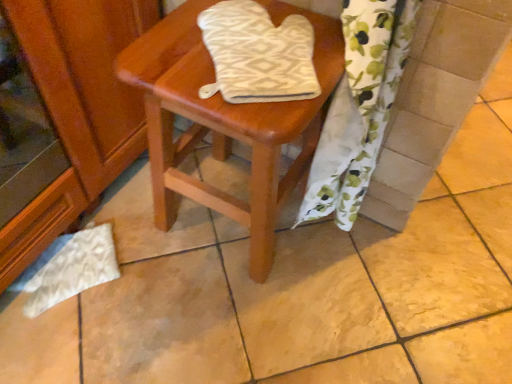
Measure the distance between point [346,131] and camera.

Point [346,131] and camera are 28.70 inches apart from each other.

The width and height of the screenshot is (512, 384). What do you see at coordinates (359, 108) in the screenshot? I see `white floral fabric at lower right` at bounding box center [359, 108].

In order to face white textured oven mitt at center, should I rotate leftwards or rightwards?

To align with it, rotate right about 2.340°.

Locate an element on the screen. This screenshot has height=384, width=512. white floral fabric at lower right is located at coordinates (359, 108).

Relative to white textured oven mitt at center, is wooden stool at center in front or behind?

Visually, wooden stool at center is located in front of white textured oven mitt at center.

Can you confirm if wooden stool at center is positioned to the right of white textured oven mitt at center?

No, wooden stool at center is not to the right of white textured oven mitt at center.

From the image's perspective, is wooden stool at center under white textured oven mitt at center?

Correct, wooden stool at center appears lower than white textured oven mitt at center in the image.

Is wooden stool at center with white textured oven mitt at center?

wooden stool at center and white textured oven mitt at center are not in contact.

Is wooden stool at center aimed at white floral fabric at lower right?

No.

Locate an element on the screen. The height and width of the screenshot is (384, 512). curtain above the wooden stool at center (from a real-world perspective) is located at coordinates (359, 108).

Consider the image. Is wooden stool at center closer to the viewer compared to white floral fabric at lower right?

That is False.

Considering their positions, is white textured oven mitt at center located in front of or behind white floral fabric at lower right?

Clearly, white textured oven mitt at center is behind white floral fabric at lower right.

Considering the points (267, 97) and (342, 103), which point is behind, point (267, 97) or point (342, 103)?

The point (342, 103) is more distant.

How far apart are white textured oven mitt at center and white floral fabric at lower right?

The distance of white textured oven mitt at center from white floral fabric at lower right is 17.68 centimeters.

Is white textured oven mitt at center looking in the opposite direction of white floral fabric at lower right?

No.

In terms of size, does white floral fabric at lower right appear bigger or smaller than wooden stool at center?

white floral fabric at lower right is smaller than wooden stool at center.

Considering the relative sizes of white floral fabric at lower right and wooden stool at center in the image provided, is white floral fabric at lower right thinner than wooden stool at center?

Correct, the width of white floral fabric at lower right is less than that of wooden stool at center.

In the scene shown: Relative to wooden stool at center, is white floral fabric at lower right in front or behind?

Visually, white floral fabric at lower right is located in front of wooden stool at center.

You are a GUI agent. You are given a task and a screenshot of the screen. Output one action in this format:
    pyautogui.click(x=<x>, y=<y>)
    Task: Click on the curtain below the white textured oven mitt at center (from a real-world perspective)
    
    Given the screenshot: What is the action you would take?
    pyautogui.click(x=359, y=108)

Is white floral fabric at lower right positioned with its back to white textured oven mitt at center?

white floral fabric at lower right is not turned away from white textured oven mitt at center.

Is white textured oven mitt at center completely or partially inside white floral fabric at lower right?

Yes, white floral fabric at lower right contains white textured oven mitt at center.

Does white floral fabric at lower right have a lesser height compared to white textured oven mitt at center?

No, white floral fabric at lower right is not shorter than white textured oven mitt at center.

Would you say white textured oven mitt at center is a long distance from wooden stool at center?

No, there isn't a large distance between white textured oven mitt at center and wooden stool at center.

Where is `beach towel that is above the wooden stool at center (from a real-world perspective)`? beach towel that is above the wooden stool at center (from a real-world perspective) is located at coordinates (258, 54).

From a real-world perspective, which is physically above, white textured oven mitt at center or wooden stool at center?

white textured oven mitt at center is physically above.

Does white textured oven mitt at center have a lesser height compared to wooden stool at center?

Yes, white textured oven mitt at center is shorter than wooden stool at center.

You are a GUI agent. You are given a task and a screenshot of the screen. Output one action in this format:
    pyautogui.click(x=<x>, y=<y>)
    Task: Click on the stool located in front of the white textured oven mitt at center
    
    Given the screenshot: What is the action you would take?
    pyautogui.click(x=225, y=121)

This screenshot has height=384, width=512. What are the coordinates of `stool behind the white floral fabric at lower right` in the screenshot? It's located at (225, 121).

In the scene shown: Estimate the real-world distances between objects in this image. Which object is further from white floral fabric at lower right, wooden stool at center or white textured oven mitt at center?

Among the two, white textured oven mitt at center is located further to white floral fabric at lower right.

From the picture: Considering their positions, is wooden stool at center positioned further to white textured oven mitt at center than white floral fabric at lower right?

Based on the image, white floral fabric at lower right appears to be further to white textured oven mitt at center.

Estimate the real-world distances between objects in this image. Which object is further from white textured oven mitt at center, white floral fabric at lower right or wooden stool at center?

The object further to white textured oven mitt at center is white floral fabric at lower right.

Estimate the real-world distances between objects in this image. Which object is further from wooden stool at center, white textured oven mitt at center or white floral fabric at lower right?

Based on the image, white floral fabric at lower right appears to be further to wooden stool at center.

Considering their positions, is white floral fabric at lower right positioned further to wooden stool at center than white textured oven mitt at center?

white floral fabric at lower right.

Looking at the image, which one is located closer to white floral fabric at lower right, white textured oven mitt at center or wooden stool at center?

Among the two, wooden stool at center is located nearer to white floral fabric at lower right.

Where is `beach towel between wooden stool at center and white floral fabric at lower right in the horizontal direction`? This screenshot has height=384, width=512. beach towel between wooden stool at center and white floral fabric at lower right in the horizontal direction is located at coordinates (258, 54).